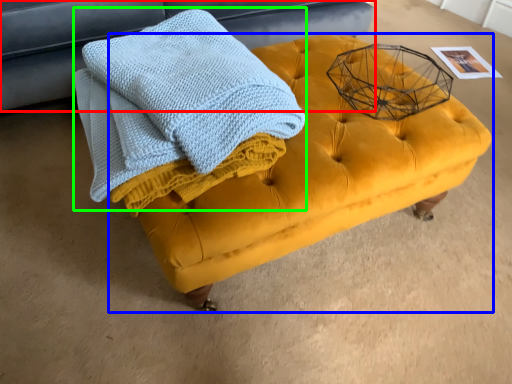
Question: Which object is positioned closest to furniture (highlighted by a red box)? Select from table (highlighted by a blue box) and bath towel (highlighted by a green box).

Choices:
 (A) table
 (B) bath towel

Answer: (B)